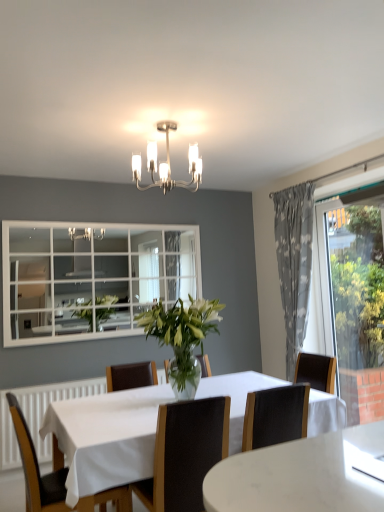
Question: Considering the relative positions of transparent glass window at right and black leather chair at center, which ranks as the 1th chair in right-to-left order, in the image provided, is transparent glass window at right to the left or to the right of black leather chair at center, which ranks as the 1th chair in right-to-left order,?

Choices:
 (A) left
 (B) right

Answer: (B)

Question: Looking at their shapes, would you say transparent glass window at right is wider or thinner than black leather chair at center, which ranks as the 1th chair in right-to-left order?

Choices:
 (A) thin
 (B) wide

Answer: (A)

Question: Which of these objects is positioned closest to the gray fabric curtain at right?

Choices:
 (A) transparent glass window at right
 (B) metallic chandelier at upper center
 (C) wooden chair at lower left, marked as the 1th chair in a left-to-right arrangement
 (D) black leather chair at center, which ranks as the 1th chair in right-to-left order
 (E) white marble table at center

Answer: (A)

Question: Estimate the real-world distances between objects in this image. Which object is closer to the wooden chair at lower left, marked as the 1th chair in a left-to-right arrangement?

Choices:
 (A) black leather chair at center, which ranks as the 1th chair in right-to-left order
 (B) metallic chandelier at upper center
 (C) gray fabric curtain at right
 (D) white marble table at center
 (E) transparent glass window at right

Answer: (D)